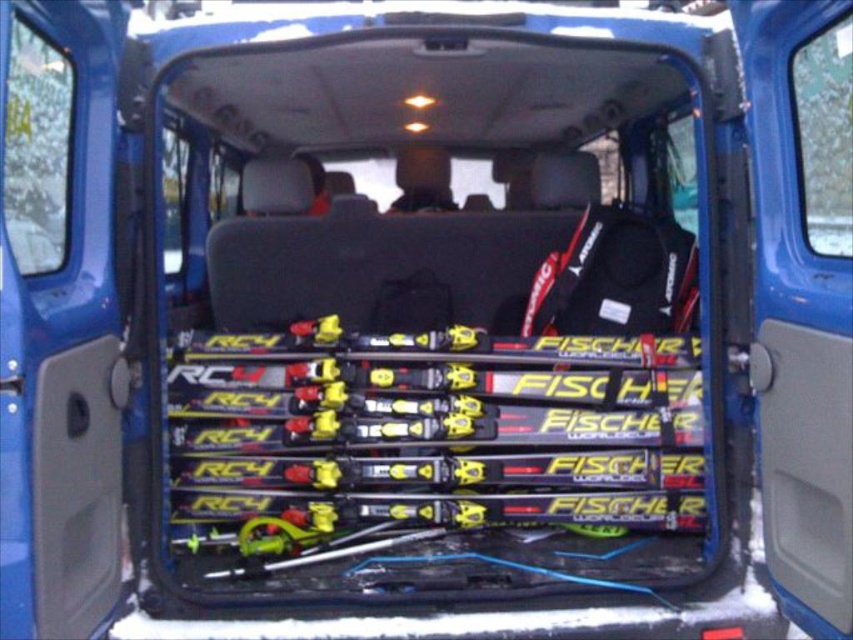
From the picture: Measure the distance from yellow matte fischer rc4 ski at center to matte black ski bag at center.

yellow matte fischer rc4 ski at center and matte black ski bag at center are 20.15 inches apart from each other.

The height and width of the screenshot is (640, 853). I want to click on yellow matte fischer rc4 ski at center, so click(432, 433).